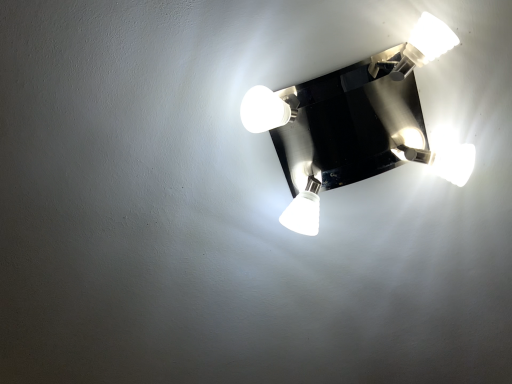
This screenshot has height=384, width=512. Identify the location of matte black light fixture at upper center. (355, 124).

The image size is (512, 384). Describe the element at coordinates (355, 124) in the screenshot. I see `matte black light fixture at upper center` at that location.

Find the location of a particular element. This screenshot has height=384, width=512. matte black light fixture at upper center is located at coordinates (355, 124).